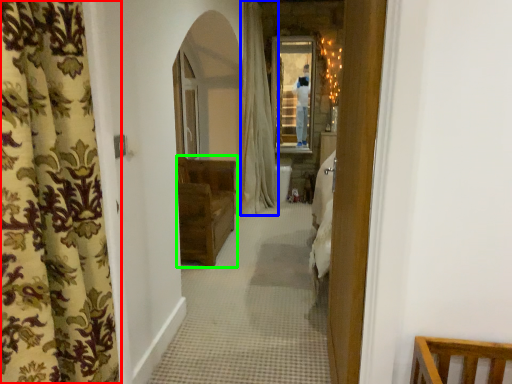
Question: Which object is positioned farthest from curtain (highlighted by a red box)? Select from curtain (highlighted by a blue box) and furniture (highlighted by a green box).

Choices:
 (A) curtain
 (B) furniture

Answer: (A)